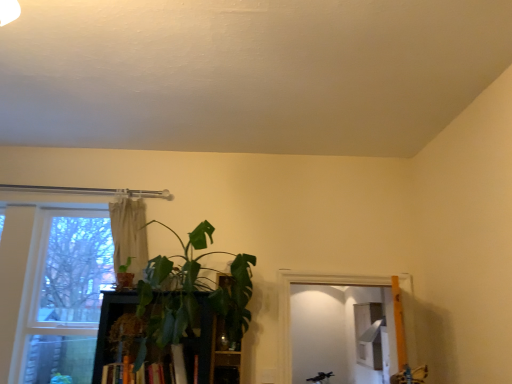
Question: Considering the positions of green matte plant at left, the second houseplant from the right, and hardcover book at center in the image, is green matte plant at left, the second houseplant from the right, bigger or smaller than hardcover book at center?

Choices:
 (A) big
 (B) small

Answer: (B)

Question: Considering the positions of green matte plant at left, the second houseplant from the right, and hardcover book at center in the image, is green matte plant at left, the second houseplant from the right, taller or shorter than hardcover book at center?

Choices:
 (A) tall
 (B) short

Answer: (B)

Question: Based on their relative distances, which object is nearer to the hardcover book at center?

Choices:
 (A) green leafy plant at center
 (B) beige fabric curtain at upper center
 (C) green matte plant at left, the 1th houseplant when ordered from left to right
 (D) clear glass window at left
 (E) green leafy plant at center, which is the 2th houseplant from left to right

Answer: (A)

Question: Which object is the farthest from the green leafy plant at center, which is counted as the first houseplant, starting from the right?

Choices:
 (A) green matte plant at left, the 1th houseplant when ordered from left to right
 (B) beige fabric curtain at upper center
 (C) hardcover book at center
 (D) green leafy plant at center
 (E) clear glass window at left

Answer: (E)